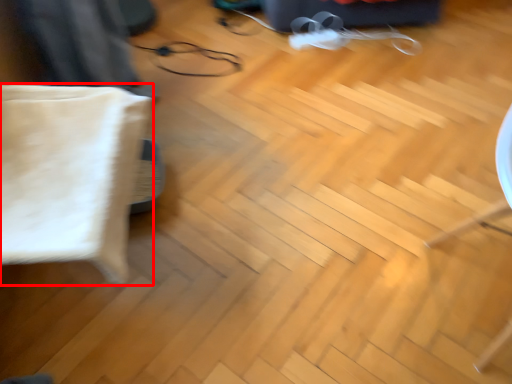
Question: From the image's perspective, where is pillow (annotated by the red box) located in relation to glasses in the image?

Choices:
 (A) below
 (B) above

Answer: (A)